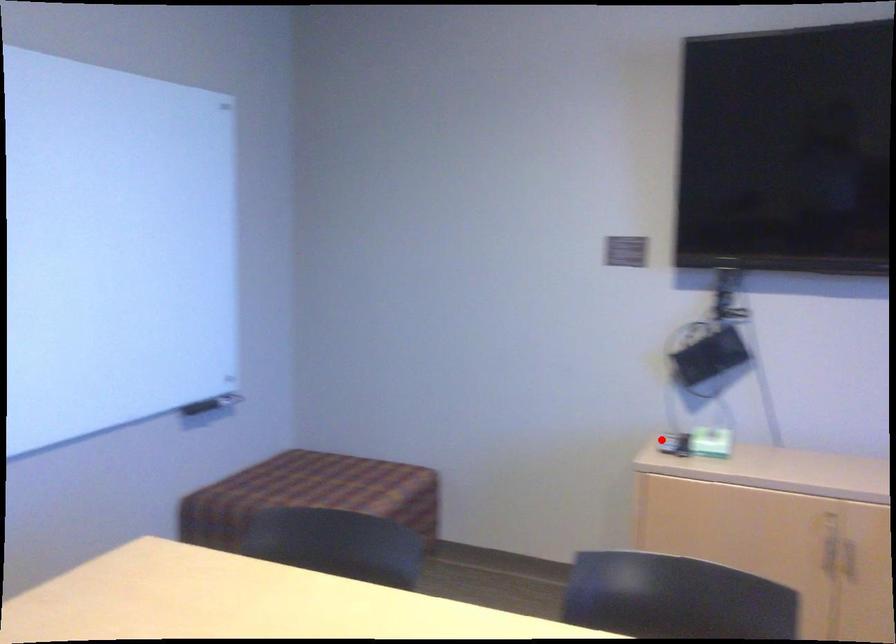
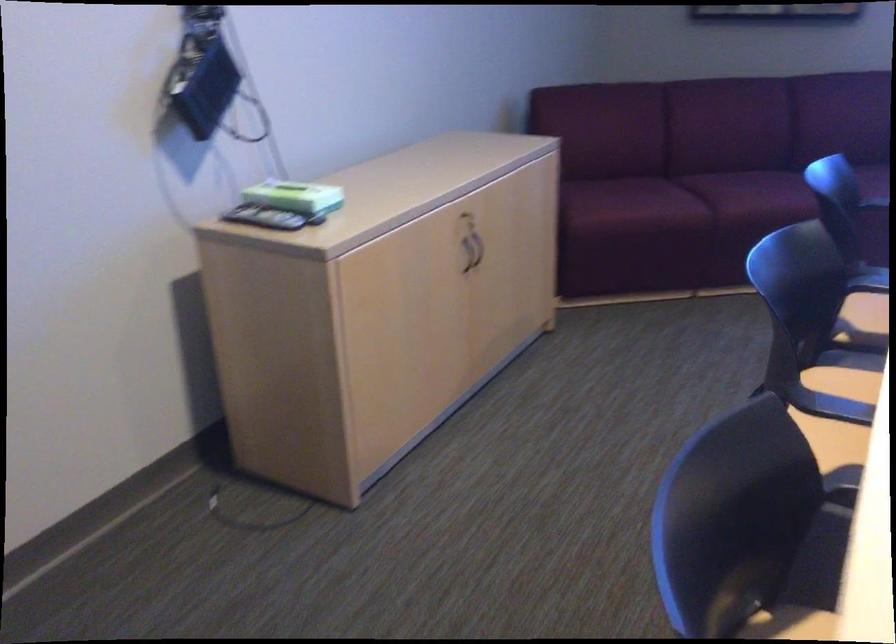
Where in the second image is the point corresponding to the highlighted location from the first image?

(263, 218)